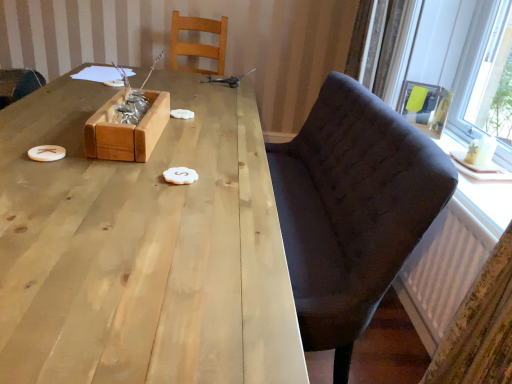
The image size is (512, 384). What are the coordinates of `vacant space that is in between wooden box at center and white matte cookie at center, which is counted as the 2th food, starting from the back` in the screenshot? It's located at (158, 157).